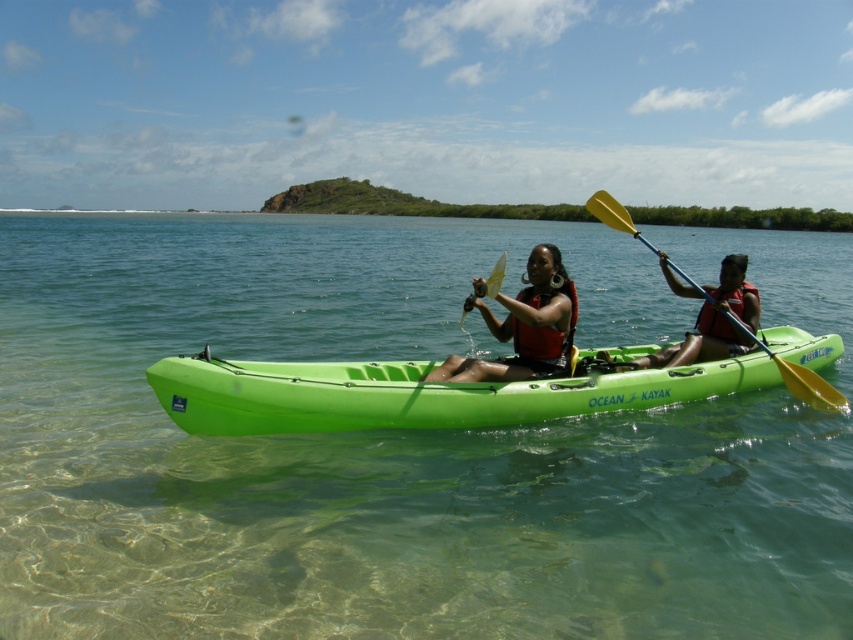
Question: Which object is the farthest from the yellow plastic paddle at center?

Choices:
 (A) matte black life vest at center
 (B) clear water at center
 (C) matte red life vest at center
 (D) yellow plastic paddle at right

Answer: (B)

Question: Is clear water at center smaller than yellow plastic paddle at center?

Choices:
 (A) no
 (B) yes

Answer: (A)

Question: Which of these objects is positioned closest to the matte black life vest at center?

Choices:
 (A) yellow plastic paddle at center
 (B) green plastic kayak at center
 (C) matte red life vest at center

Answer: (B)

Question: Is yellow plastic paddle at right above yellow plastic paddle at center?

Choices:
 (A) yes
 (B) no

Answer: (B)

Question: Observing the image, what is the correct spatial positioning of matte red life vest at center in reference to yellow plastic paddle at center?

Choices:
 (A) below
 (B) above

Answer: (A)

Question: Which point is closer to the camera?

Choices:
 (A) matte red life vest at center
 (B) green plastic kayak at center
 (C) yellow plastic paddle at right
 (D) yellow plastic paddle at center

Answer: (D)